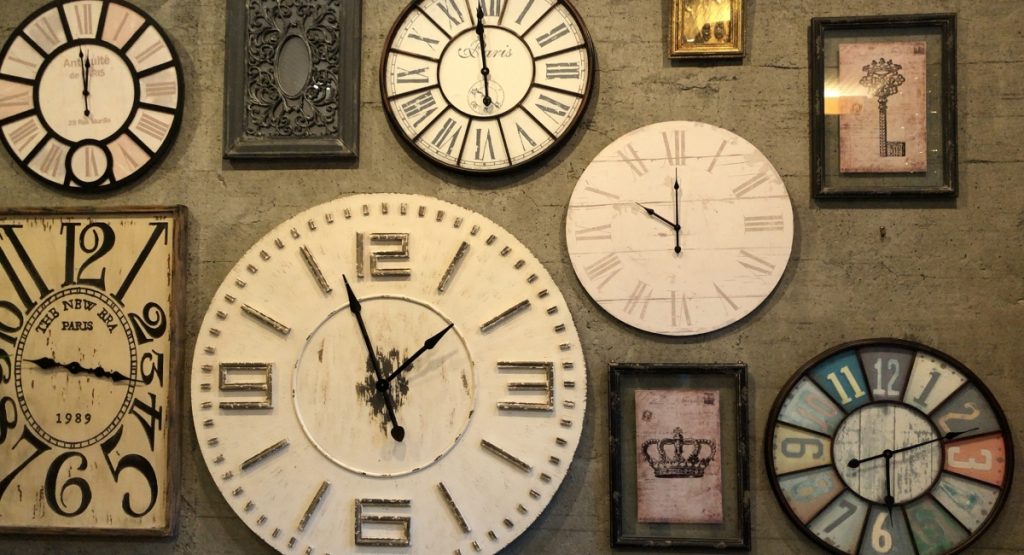
This screenshot has height=555, width=1024. Identify the location of portrait. (272, 117), (678, 24), (648, 400), (885, 105).